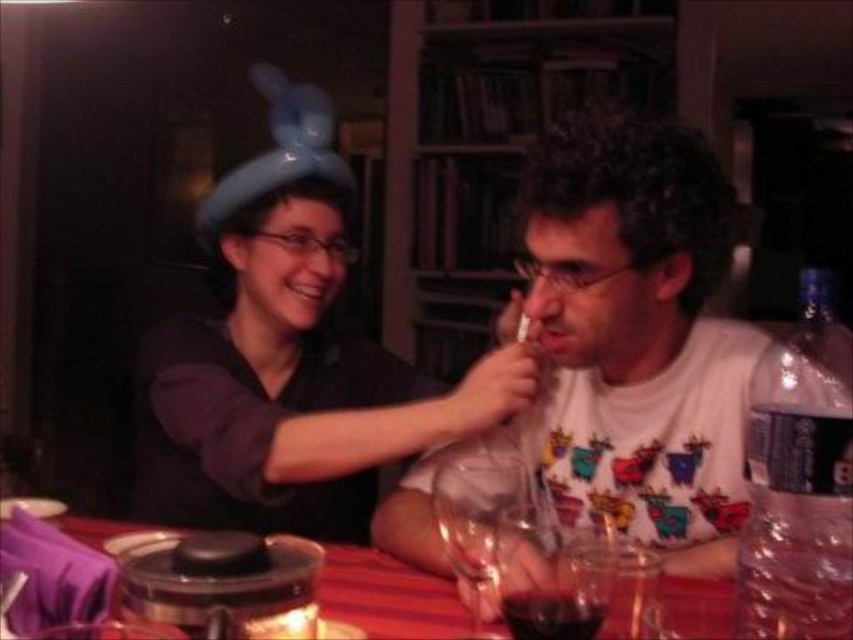
Question: Considering the real-world distances, which object is closest to the red plastic table at center?

Choices:
 (A) white matte shirt at center
 (B) transparent glass wine at center
 (C) dark red liquid at glass center

Answer: (B)

Question: Which of the following is the closest to the observer?

Choices:
 (A) clear plastic bottle at right
 (B) transparent glass wine at center

Answer: (A)

Question: Can you confirm if transparent glass wine at center is positioned to the right of dark red liquid at glass center?

Choices:
 (A) yes
 (B) no

Answer: (B)

Question: Is white matte shirt at center closer to camera compared to clear plastic bottle at right?

Choices:
 (A) yes
 (B) no

Answer: (B)

Question: Among these objects, which one is farthest from the camera?

Choices:
 (A) dark red liquid at glass center
 (B) clear plastic bottle at right
 (C) red plastic table at center
 (D) white matte shirt at center

Answer: (C)

Question: Is white matte shirt at center wider than transparent glass wine at center?

Choices:
 (A) no
 (B) yes

Answer: (B)